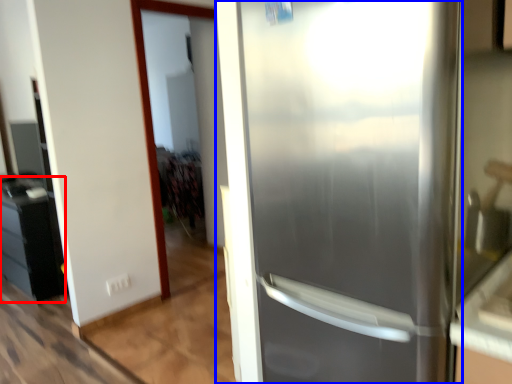
Question: Which object is further to the camera taking this photo, cabinetry (highlighted by a red box) or refrigerator (highlighted by a blue box)?

Choices:
 (A) cabinetry
 (B) refrigerator

Answer: (A)